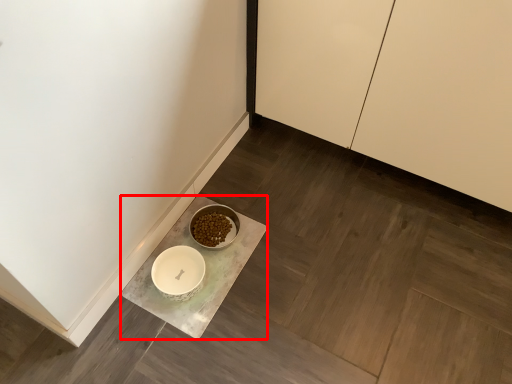
Question: From the image's perspective, what is the correct spatial relationship of counter (annotated by the red box) in relation to cabinetry?

Choices:
 (A) below
 (B) above

Answer: (A)